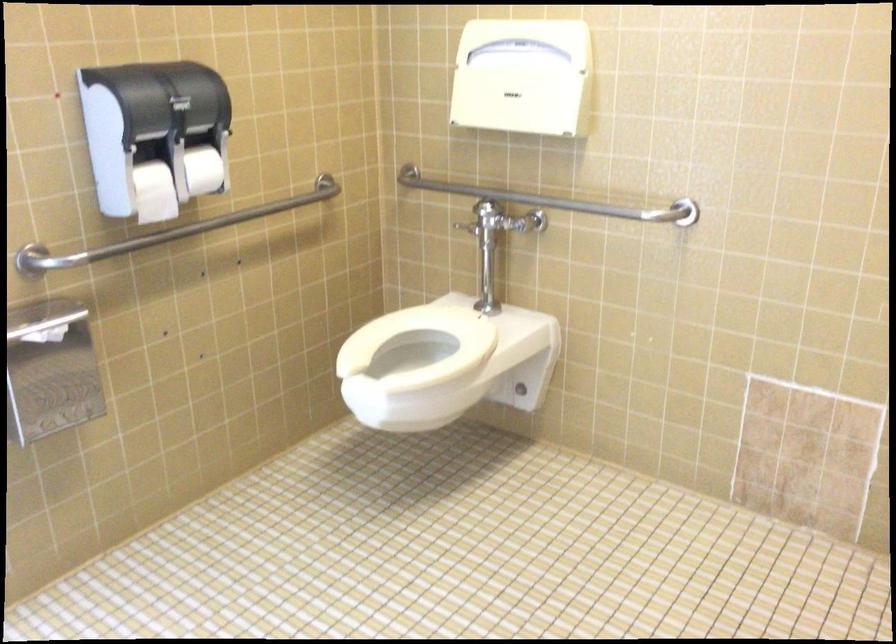
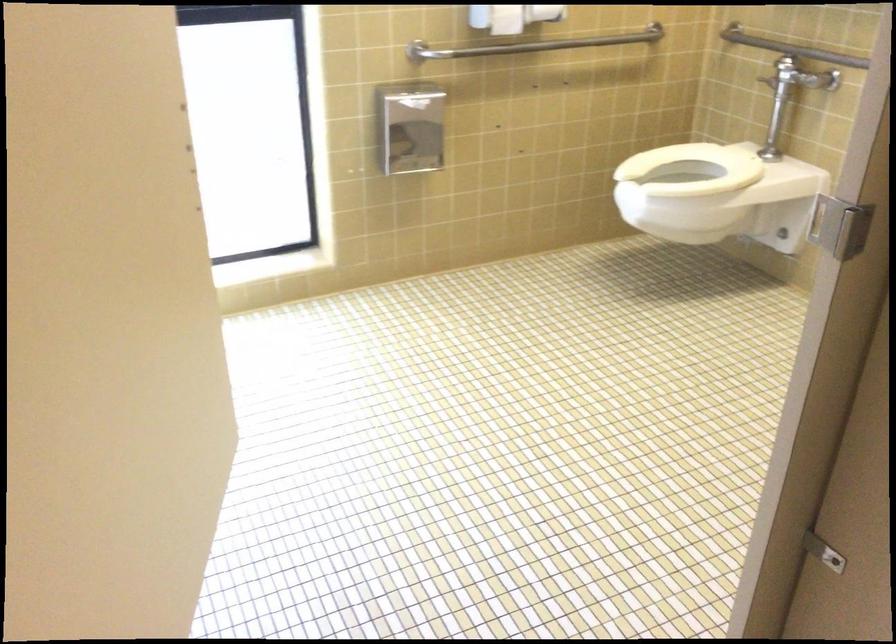
In the second image, find the point that corresponds to [156,210] in the first image.

(506, 20)